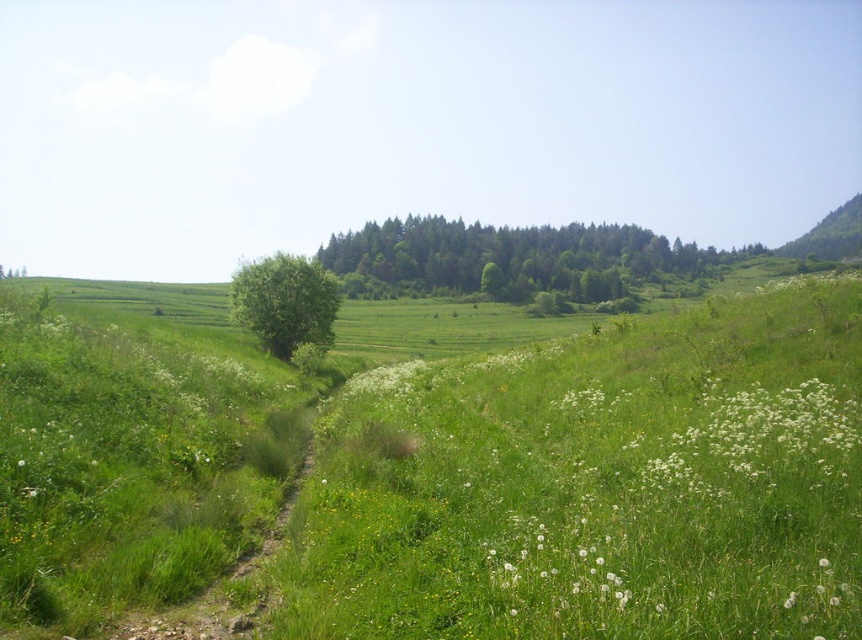
You are standing at the point marked as point (595,484) in the image. Looking around, what is the immediate surface you are standing on?

The immediate surface at point (595,484) is green grass at center.

You are standing at the starting point of the dirt path in the foreground. You want to reach the green leafy tree at center. Which direction should you head?

The green leafy tree at center is located at point (285,301), so you should head towards the center of the image to reach it.

You are standing at the origin point of the image coordinate system. You want to walk to the green grass at center. Which direction should you move in terms of the coordinate system?

The green grass at center is located at coordinate point 0.759 on the x axis and 0.691 on the y axis, so you should move towards increasing x and y directions from the origin to reach it.